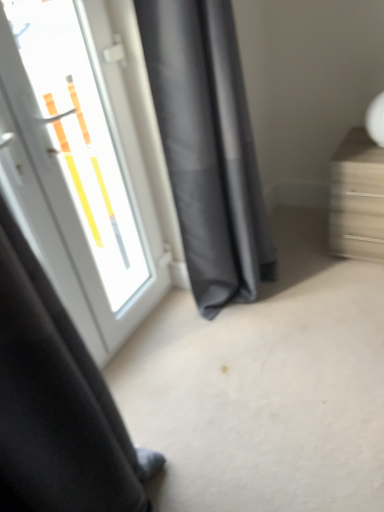
I want to click on free space to the right of white glossy door at upper left, so click(x=213, y=330).